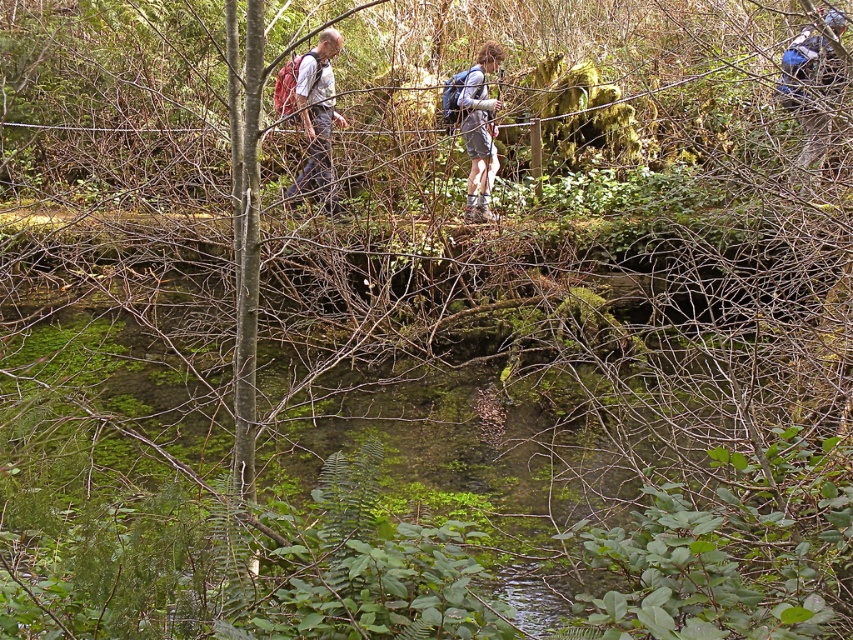
You are a hiker who has just started exploring the forest. You remember leaving your matte red backpack at upper left somewhere near the start of the trail. Based on the coordinates provided, can you determine if the backpack is positioned closer to the top or bottom of the image?

The matte red backpack at upper left is located at coordinates point (317, 118). Since the y coordinate is 0.373, which is closer to the bottom of the image, the backpack is positioned closer to the bottom.

You are a hiker trying to decide whether to place your matte red backpack at upper left on the elevated path where the matte gray shorts at center is located. Based on their heights, will the backpack fit without blocking the path?

The matte red backpack at upper left is shorter than the matte gray shorts at center, so it should fit on the elevated path without blocking the path since it is shorter in height.